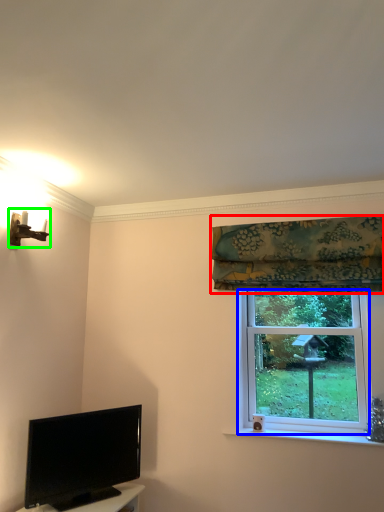
Question: Estimate the real-world distances between objects in this image. Which object is farther from curtain (highlighted by a red box), window screen (highlighted by a blue box) or light fixture (highlighted by a green box)?

Choices:
 (A) window screen
 (B) light fixture

Answer: (B)